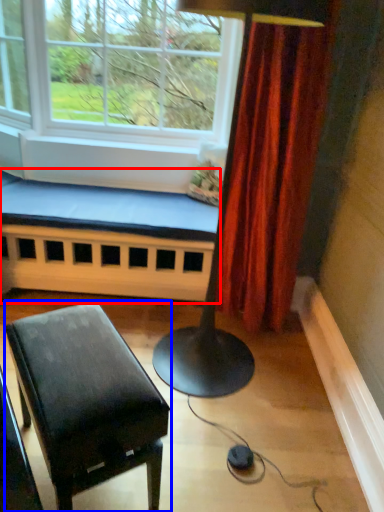
Question: Among these objects, which one is farthest to the camera, church bench (highlighted by a red box) or table (highlighted by a blue box)?

Choices:
 (A) church bench
 (B) table

Answer: (A)